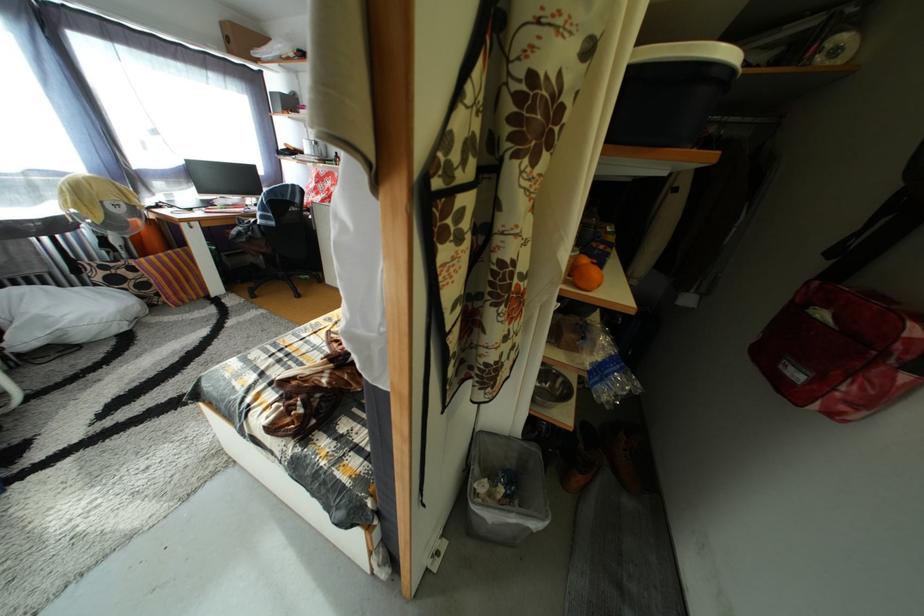
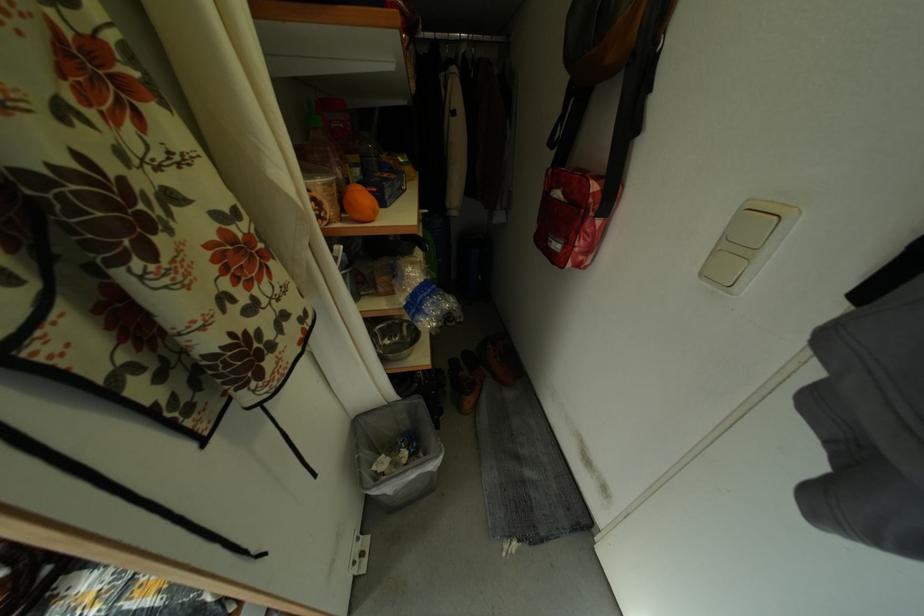
In the second image, find the point that corresponds to [843,397] in the first image.

(584, 253)